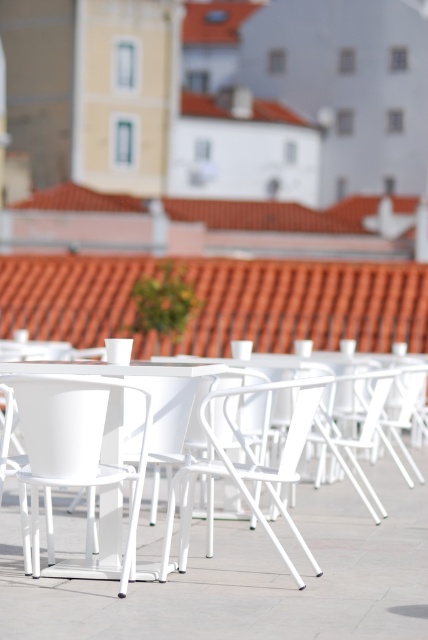
You are a customer sitting at the white plastic table at center and want to grab the menu from the white metal chair at center. Can you reach it without moving from your seat?

The white plastic table at center is closer to the viewer than the white metal chair at center, so you can reach the menu from the white metal chair at center without needing to move from your seat.